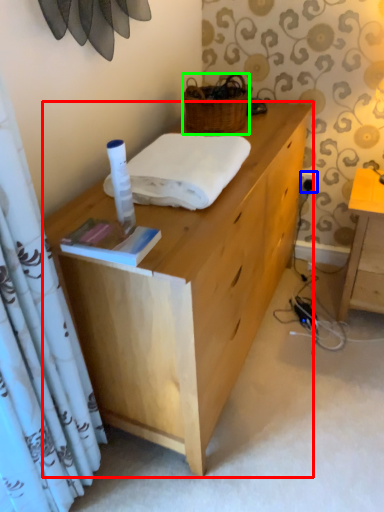
Question: Considering the real-world distances, which object is farthest from desk (highlighted by a red box)? power outlet (highlighted by a blue box) or picnic basket (highlighted by a green box)?

Choices:
 (A) power outlet
 (B) picnic basket

Answer: (A)